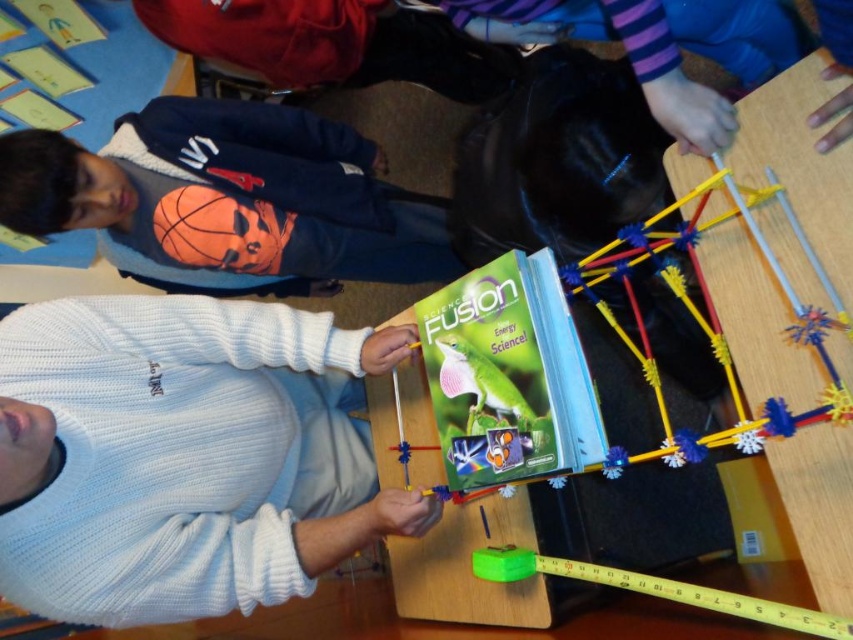
You are an observer in the room and want to know which of the two sweaters is thinner. Which one is thinner between the white knitted sweater at center and the matte blue sweatshirt at left?

The white knitted sweater at center is thinner than the matte blue sweatshirt at left according to the description.

You are a participant in the science activity and need to hand your project to the person wearing the white knitted sweater at center. The project is 2 feet tall. Can you safely pass it without hitting anyone or anything? Explain your reasoning.

The white knitted sweater at center is 26.96 inches away from the camera. Since 2 feet equals 24 inches, the height of the project is shorter than the distance to the person. Therefore, you can safely pass the project without hitting anyone or anything.